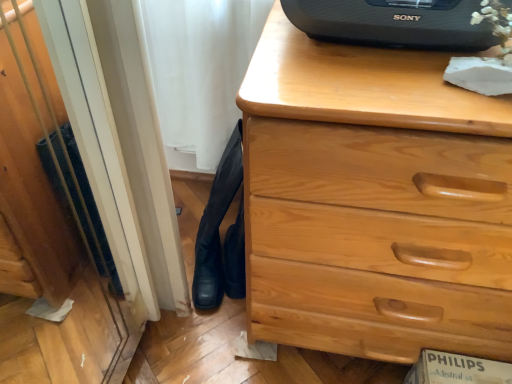
Question: Would you consider black leather boots at lower left to be distant from light wood chest of drawers at center?

Choices:
 (A) no
 (B) yes

Answer: (A)

Question: From the image's perspective, is black leather boots at lower left located beneath light wood chest of drawers at center?

Choices:
 (A) yes
 (B) no

Answer: (A)

Question: From a real-world perspective, is black leather boots at lower left over light wood chest of drawers at center?

Choices:
 (A) yes
 (B) no

Answer: (B)

Question: Is black leather boots at lower left wider than light wood chest of drawers at center?

Choices:
 (A) yes
 (B) no

Answer: (B)

Question: Does black leather boots at lower left have a smaller size compared to light wood chest of drawers at center?

Choices:
 (A) yes
 (B) no

Answer: (A)

Question: Considering the relative sizes of black leather boots at lower left and light wood chest of drawers at center in the image provided, is black leather boots at lower left bigger than light wood chest of drawers at center?

Choices:
 (A) no
 (B) yes

Answer: (A)

Question: Is light wood chest of drawers at center shorter than black plastic speaker at upper center?

Choices:
 (A) no
 (B) yes

Answer: (A)

Question: Considering the relative positions of light wood chest of drawers at center and black plastic speaker at upper center in the image provided, is light wood chest of drawers at center in front of black plastic speaker at upper center?

Choices:
 (A) no
 (B) yes

Answer: (B)

Question: Does light wood chest of drawers at center have a lesser width compared to black plastic speaker at upper center?

Choices:
 (A) yes
 (B) no

Answer: (B)

Question: Can you confirm if light wood chest of drawers at center is wider than black plastic speaker at upper center?

Choices:
 (A) no
 (B) yes

Answer: (B)

Question: From a real-world perspective, is light wood chest of drawers at center beneath black plastic speaker at upper center?

Choices:
 (A) no
 (B) yes

Answer: (B)

Question: Is light wood chest of drawers at center at the left side of black plastic speaker at upper center?

Choices:
 (A) yes
 (B) no

Answer: (B)

Question: Is light wood chest of drawers at center smaller than black leather boots at lower left?

Choices:
 (A) yes
 (B) no

Answer: (B)